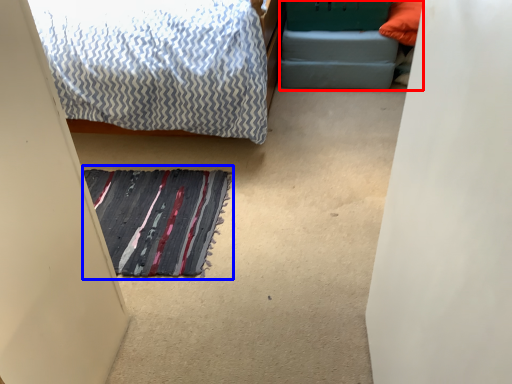
Question: Which point is closer to the camera, bed frame (highlighted by a red box) or doormat (highlighted by a blue box)?

Choices:
 (A) bed frame
 (B) doormat

Answer: (B)